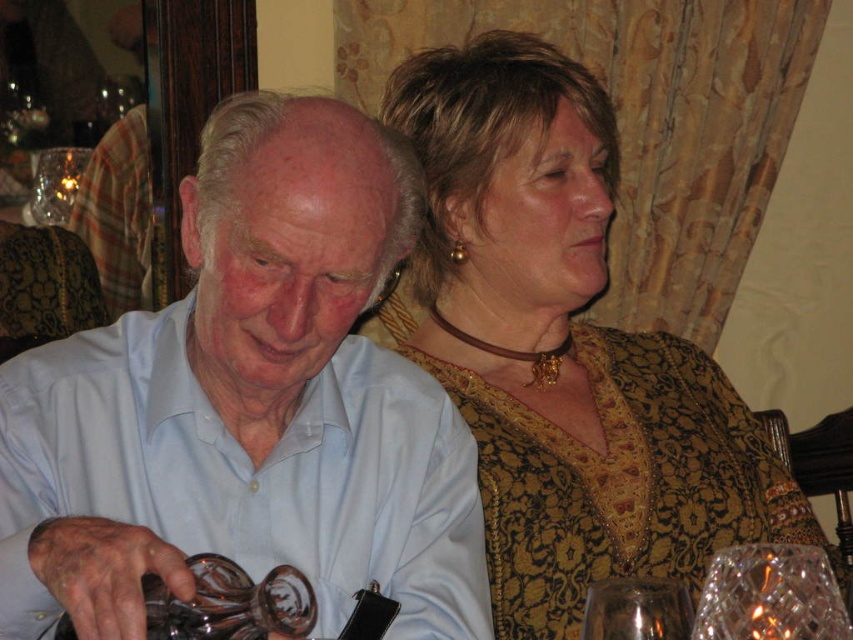
Can you confirm if gold textured dress at upper right is positioned to the right of transparent glass at lower right?

In fact, gold textured dress at upper right is to the left of transparent glass at lower right.

Does gold textured dress at upper right have a lesser height compared to transparent glass at lower right?

No, gold textured dress at upper right is not shorter than transparent glass at lower right.

Which is in front, point (401, 83) or point (608, 632)?

Point (608, 632)

At what (x,y) coordinates should I click in order to perform the action: click on gold textured dress at upper right. Please return your answer as a coordinate pair (x, y). The width and height of the screenshot is (853, 640). Looking at the image, I should click on (561, 346).

Between matte glass wine at left and gold textured dress at upper right, which one has less height?

With less height is matte glass wine at left.

Is matte glass wine at left thinner than gold textured dress at upper right?

Indeed, matte glass wine at left has a lesser width compared to gold textured dress at upper right.

Which is in front, point (206, 502) or point (670, 547)?

Positioned in front is point (206, 502).

Locate an element on the screen. This screenshot has height=640, width=853. matte glass wine at left is located at coordinates (248, 404).

The image size is (853, 640). In order to click on gold textured dress at upper right in this screenshot , I will do (x=561, y=346).

Measure the distance from gold textured dress at upper right to crystal clear glass at lower right.

A distance of 72.55 centimeters exists between gold textured dress at upper right and crystal clear glass at lower right.

At what (x,y) coordinates should I click in order to perform the action: click on gold textured dress at upper right. Please return your answer as a coordinate pair (x, y). This screenshot has height=640, width=853. Looking at the image, I should click on (561, 346).